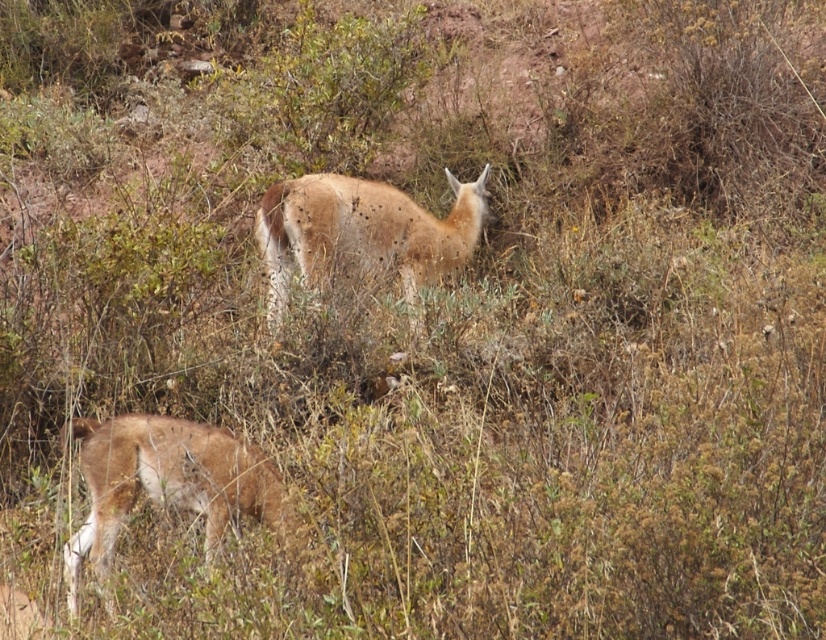
Who is more distant from viewer, (169,432) or (257,221)?

The point (257,221) is more distant.

Is point (160, 481) more distant than point (402, 200)?

That is False.

This screenshot has width=826, height=640. Identify the location of brown furry antelope at lower left. (165, 483).